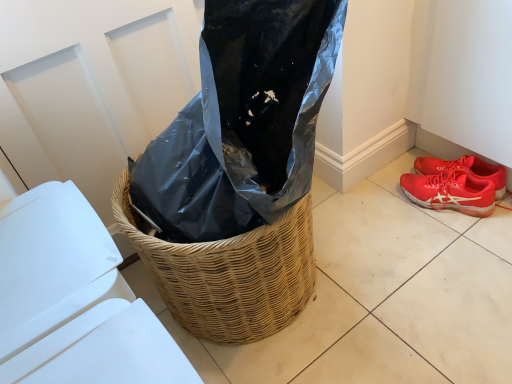
Question: Is white plastic lid at lower left not within red mesh shoe at lower right, which is the 1th footwear in top-to-bottom order?

Choices:
 (A) yes
 (B) no

Answer: (A)

Question: Is white plastic lid at lower left closer to camera compared to red mesh shoe at lower right, which is the 1th footwear in top-to-bottom order?

Choices:
 (A) no
 (B) yes

Answer: (B)

Question: Is white plastic lid at lower left to the right of red mesh shoe at lower right, the 2th footwear positioned from the bottom, from the viewer's perspective?

Choices:
 (A) no
 (B) yes

Answer: (A)

Question: Does white plastic lid at lower left have a smaller size compared to red mesh shoe at lower right, the 2th footwear positioned from the bottom?

Choices:
 (A) no
 (B) yes

Answer: (A)

Question: Does white plastic lid at lower left have a greater width compared to red mesh shoe at lower right, which is the 1th footwear in top-to-bottom order?

Choices:
 (A) yes
 (B) no

Answer: (A)

Question: Considering the relative positions of white plastic lid at lower left and red mesh shoe at lower right, which is the 1th footwear in top-to-bottom order, in the image provided, is white plastic lid at lower left to the left of red mesh shoe at lower right, which is the 1th footwear in top-to-bottom order, from the viewer's perspective?

Choices:
 (A) no
 (B) yes

Answer: (B)

Question: Is white plastic lid at lower left wider than shiny red sneakers at lower right, which is the first footwear in bottom-to-top order?

Choices:
 (A) yes
 (B) no

Answer: (A)

Question: From a real-world perspective, is white plastic lid at lower left located higher than shiny red sneakers at lower right, acting as the 2th footwear starting from the top?

Choices:
 (A) yes
 (B) no

Answer: (A)

Question: Is white plastic lid at lower left completely or partially outside of shiny red sneakers at lower right, which is the first footwear in bottom-to-top order?

Choices:
 (A) no
 (B) yes

Answer: (B)

Question: Can you confirm if white plastic lid at lower left is smaller than shiny red sneakers at lower right, which is the first footwear in bottom-to-top order?

Choices:
 (A) no
 (B) yes

Answer: (A)

Question: From the image's perspective, would you say white plastic lid at lower left is shown under shiny red sneakers at lower right, which is the first footwear in bottom-to-top order?

Choices:
 (A) no
 (B) yes

Answer: (B)

Question: Can you confirm if white plastic lid at lower left is shorter than shiny red sneakers at lower right, which is the first footwear in bottom-to-top order?

Choices:
 (A) yes
 (B) no

Answer: (B)

Question: From the image's perspective, would you say shiny red sneakers at lower right, which is the first footwear in bottom-to-top order, is positioned over red mesh shoe at lower right, the 2th footwear positioned from the bottom?

Choices:
 (A) no
 (B) yes

Answer: (A)